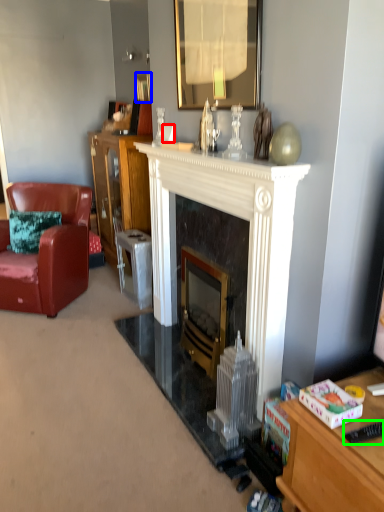
Question: Considering the real-world distances, which object is closest to coffee cup (highlighted by a red box)? picture frame (highlighted by a blue box) or remote control (highlighted by a green box).

Choices:
 (A) picture frame
 (B) remote control

Answer: (A)